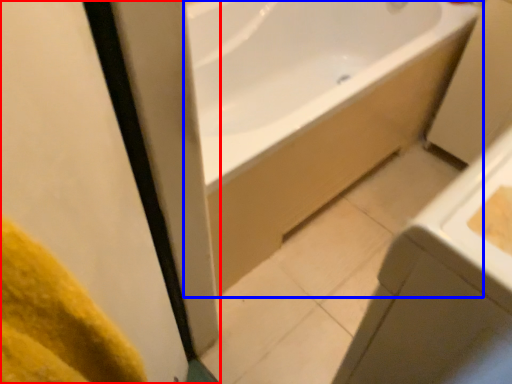
Question: Which object is closer to the camera taking this photo, screen door (highlighted by a red box) or bathtub (highlighted by a blue box)?

Choices:
 (A) screen door
 (B) bathtub

Answer: (A)